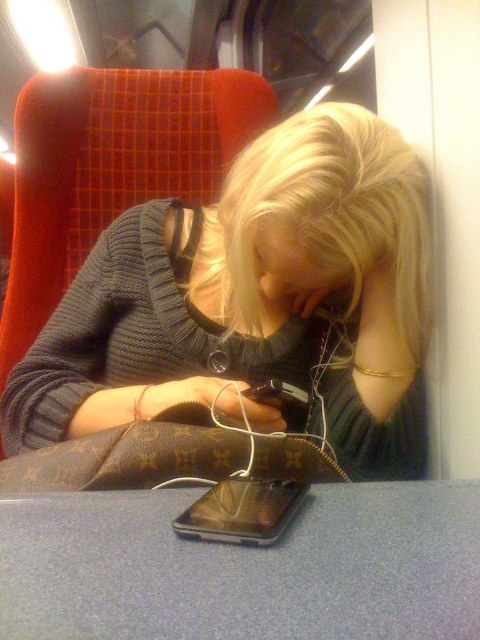
Is knitted sweater at center positioned before shiny metallic phone at center?

No, it is not.

Measure the distance between knitted sweater at center and camera.

A distance of 26.05 inches exists between knitted sweater at center and camera.

Where is `knitted sweater at center`? The height and width of the screenshot is (640, 480). knitted sweater at center is located at coordinates (253, 300).